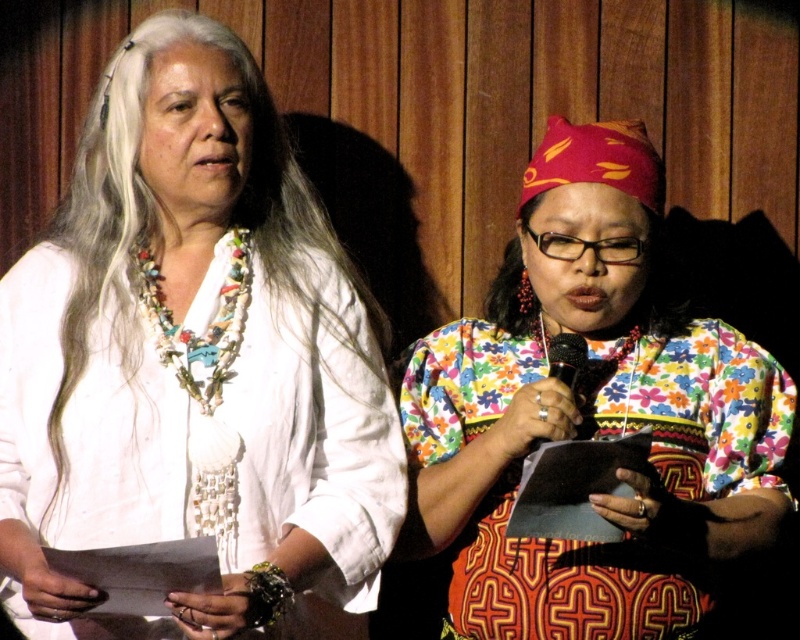
Question: Which of the following is the farthest from the observer?

Choices:
 (A) (592, 396)
 (B) (214, 433)
 (C) (168, 324)

Answer: (A)

Question: Considering the real-world distances, which object is closest to the white beaded necklace at center?

Choices:
 (A) matte silver necklace at center
 (B) floral fabric dress at center

Answer: (B)

Question: Does floral fabric dress at center appear on the right side of multicolored beaded necklace at left?

Choices:
 (A) yes
 (B) no

Answer: (A)

Question: Which point is farther to the camera?

Choices:
 (A) white beaded necklace at center
 (B) multicolored beaded necklace at left

Answer: (B)

Question: Does floral fabric dress at center appear on the left side of matte silver necklace at center?

Choices:
 (A) yes
 (B) no

Answer: (B)

Question: Is multicolored beaded necklace at left to the left of matte silver necklace at center from the viewer's perspective?

Choices:
 (A) no
 (B) yes

Answer: (B)